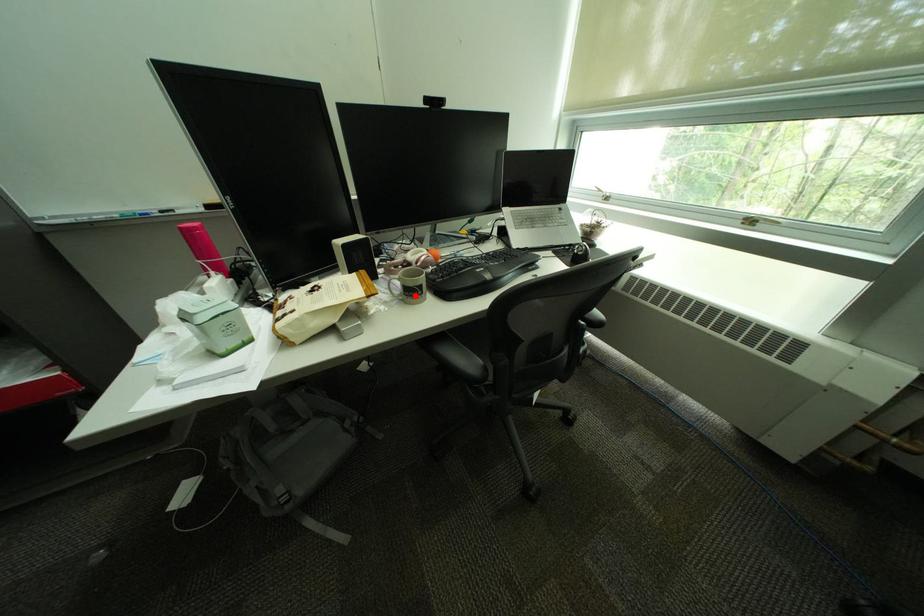
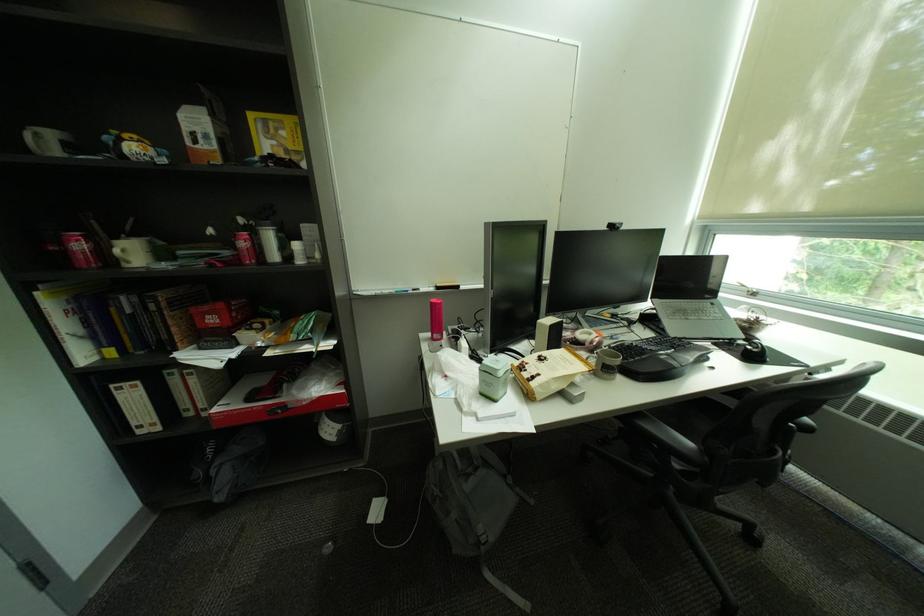
Question: I am providing you with two images of the same scene from different viewpoints. Given a red point in image1, look at the same physical point in image2. Is it:

Choices:
 (A) Closer to the viewpoint
 (B) Farther from the viewpoint

Answer: (B)